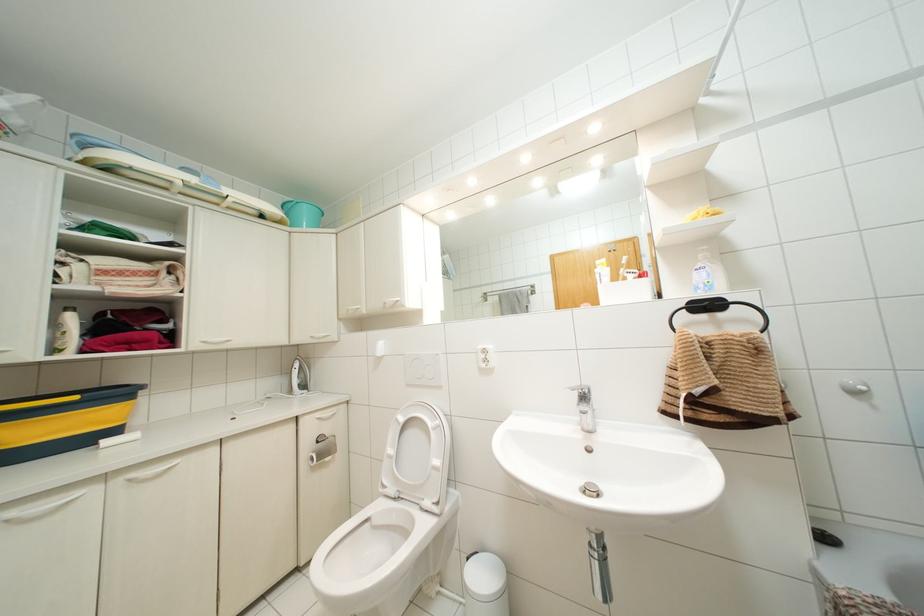
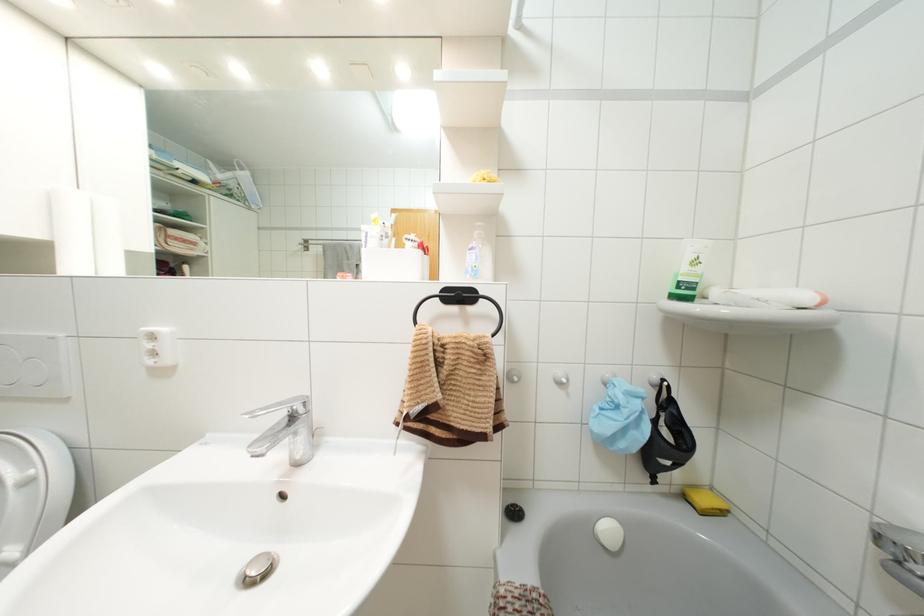
Where in the second image is the point corresponding to (x=598, y=495) from the first image?

(265, 573)